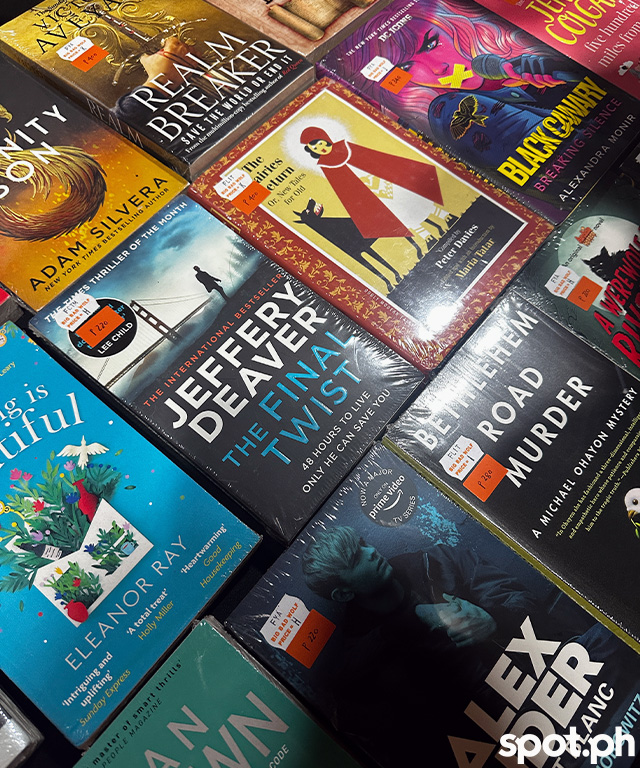
Find the location of a particular element. Image resolution: width=640 pixels, height=768 pixels. book is located at coordinates click(248, 81).